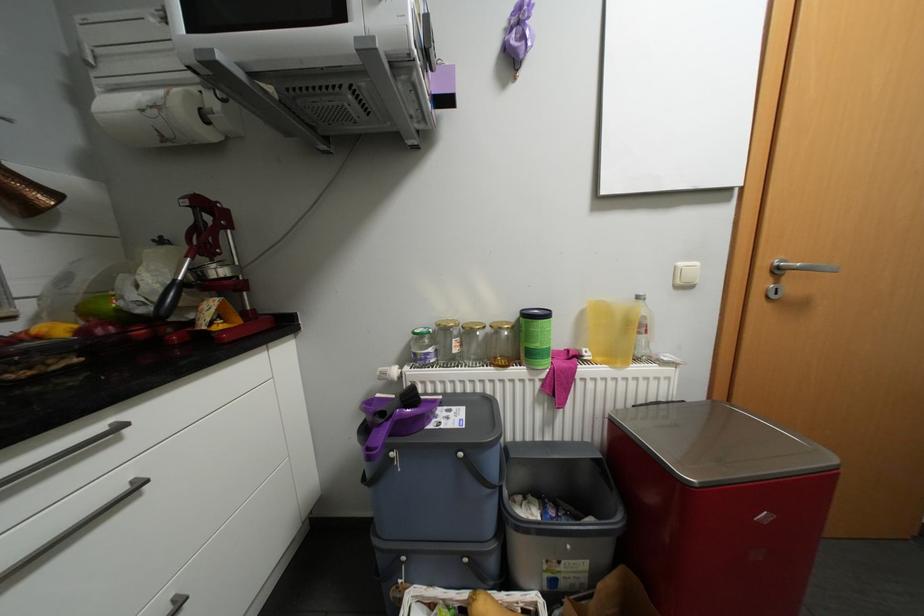
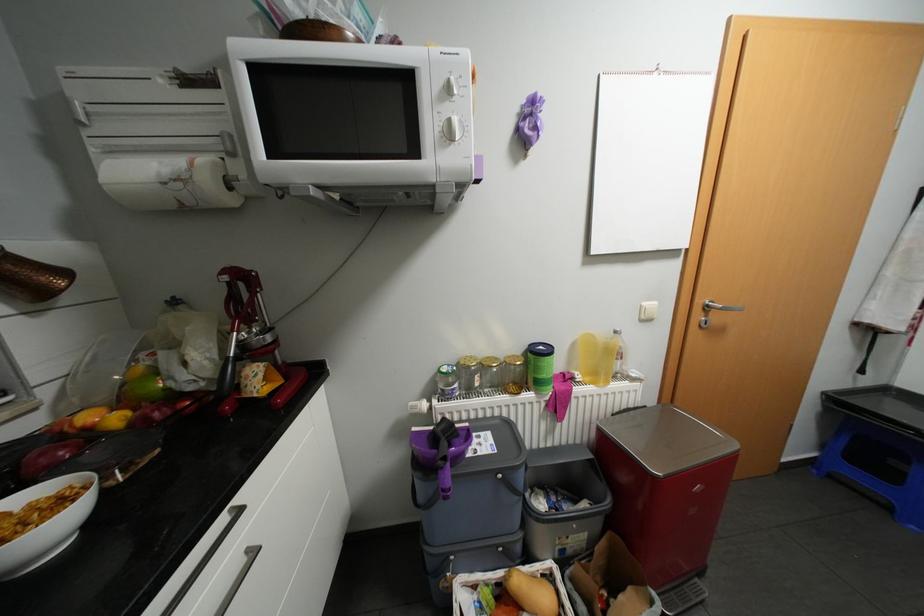
Find the pixel in the second image that matches [650,403] in the first image.

(626, 411)